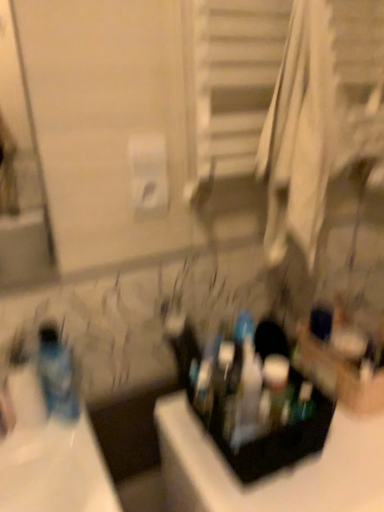
The image size is (384, 512). Find the location of `vacant space that is to the left of translucent plastic mouthwash at center`. vacant space that is to the left of translucent plastic mouthwash at center is located at coordinates (251, 412).